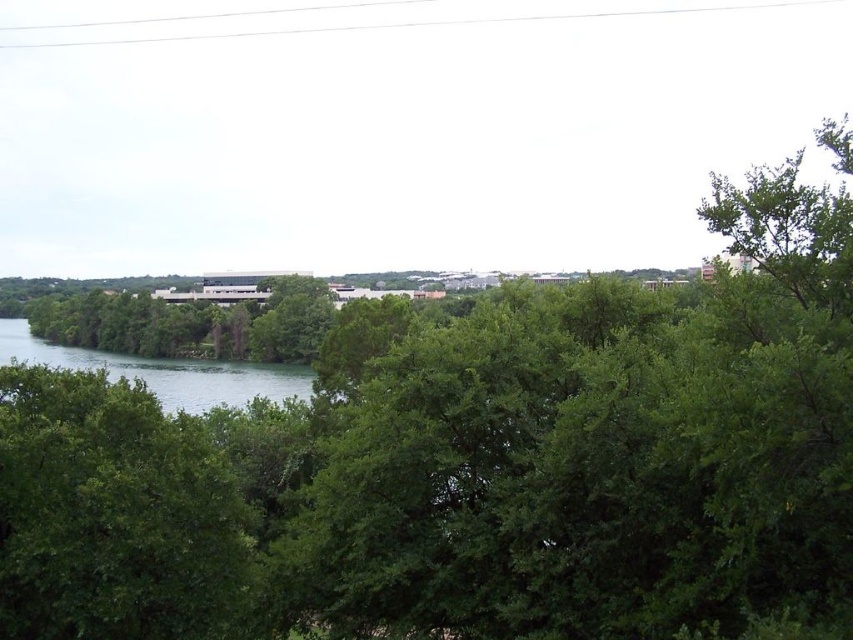
Image resolution: width=853 pixels, height=640 pixels. Identify the location of green leafy tree at left. (115, 515).

Which is more to the left, green leafy tree at left or green water at lower left?

green water at lower left is more to the left.

You are a GUI agent. You are given a task and a screenshot of the screen. Output one action in this format:
    pyautogui.click(x=<x>, y=<y>)
    Task: Click on the green leafy tree at left
    The width and height of the screenshot is (853, 640).
    Given the screenshot: What is the action you would take?
    pyautogui.click(x=115, y=515)

Locate an element on the screen. green leafy tree at left is located at coordinates (115, 515).